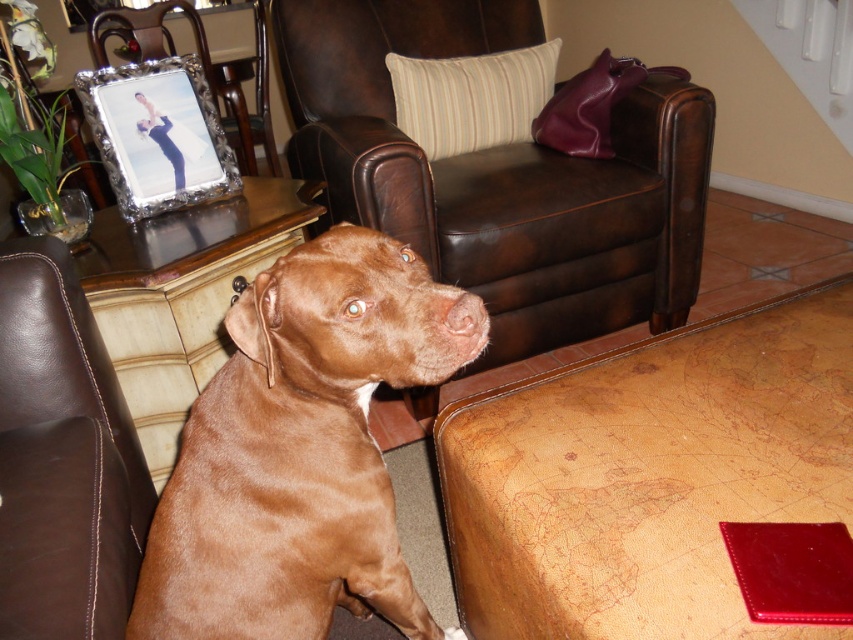
Can you confirm if brown leather armchair at center is positioned above brown smooth dog at center?

Yes, brown leather armchair at center is above brown smooth dog at center.

In the scene shown: Is brown leather armchair at center positioned before brown smooth dog at center?

No.

Is point (660, 280) behind point (248, 483)?

Yes.

At what (x,y) coordinates should I click in order to perform the action: click on brown leather armchair at center. Please return your answer as a coordinate pair (x, y). Image resolution: width=853 pixels, height=640 pixels. Looking at the image, I should click on (502, 176).

Does brown smooth dog at center appear on the right side of silver metallic frame at upper left?

Indeed, brown smooth dog at center is positioned on the right side of silver metallic frame at upper left.

Is point (300, 525) farther from viewer compared to point (109, 24)?

That is False.

Identify the location of brown smooth dog at center. (300, 451).

Is brown leather armchair at center thinner than brown leather couch at lower left?

No.

Is the position of brown leather armchair at center more distant than that of brown leather couch at lower left?

Yes, brown leather armchair at center is behind brown leather couch at lower left.

This screenshot has width=853, height=640. In order to click on brown leather armchair at center in this screenshot , I will do `click(502, 176)`.